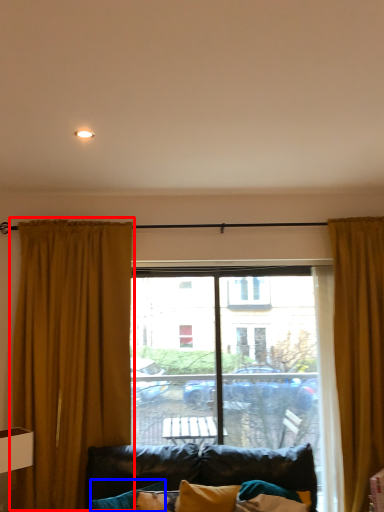
Question: Which of the following is the farthest to the observer, curtain (highlighted by a red box) or pillow (highlighted by a blue box)?

Choices:
 (A) curtain
 (B) pillow

Answer: (A)